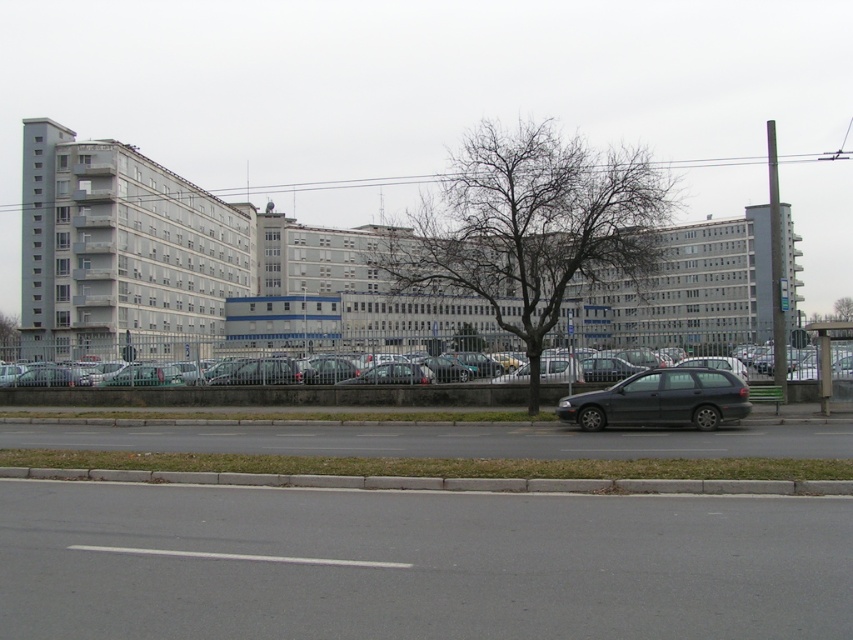
Question: In this image, where is silver metallic sedan at center located relative to matte black station wagon at center?

Choices:
 (A) above
 (B) below

Answer: (A)

Question: Which of the following is the closest to the observer?

Choices:
 (A) click(701, 371)
 (B) click(315, 371)

Answer: (A)

Question: Is silver metallic sedan at center below matte black station wagon at center?

Choices:
 (A) no
 (B) yes

Answer: (A)

Question: Which of the following is the closest to the observer?

Choices:
 (A) (24, 378)
 (B) (704, 401)

Answer: (B)

Question: Is silver metallic sedan at center smaller than matte black station wagon at center?

Choices:
 (A) yes
 (B) no

Answer: (B)